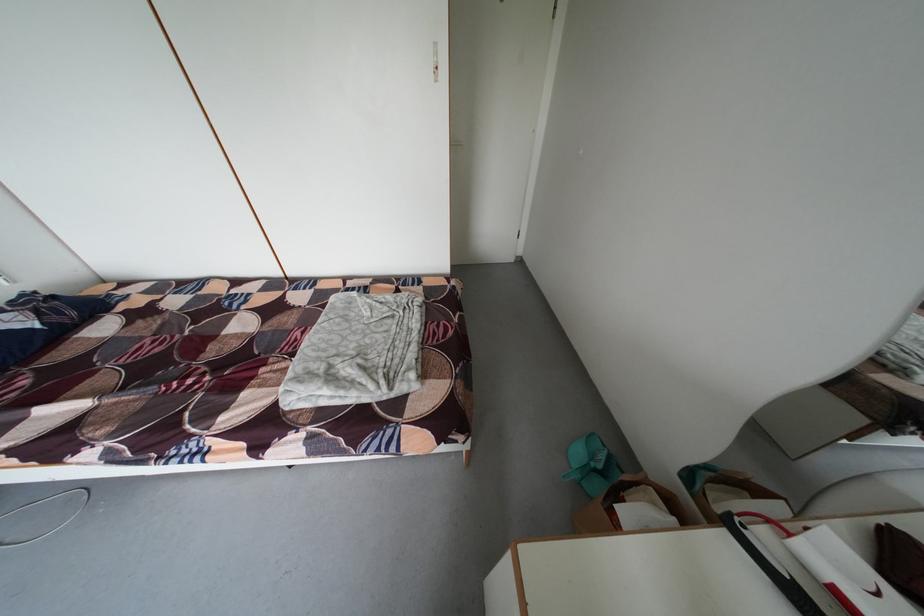
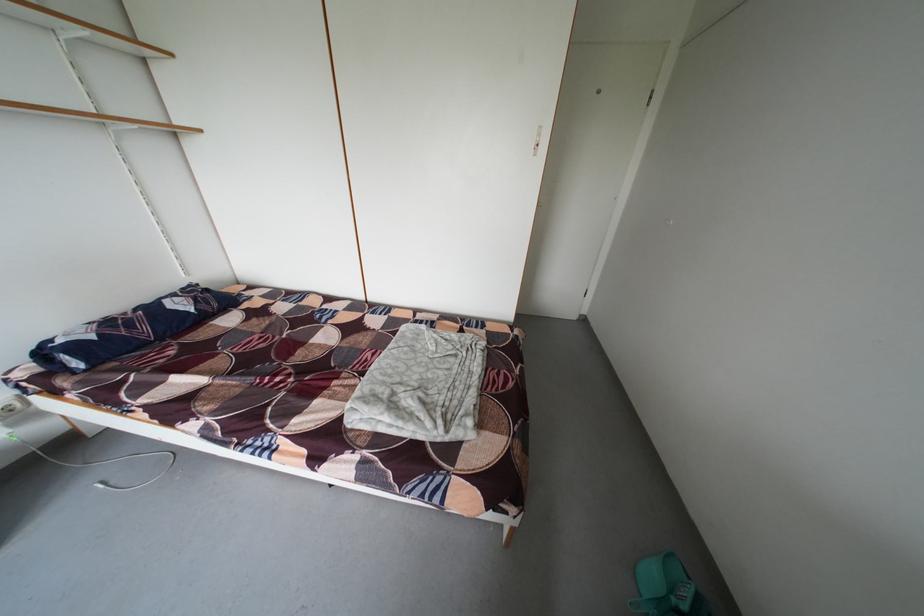
Question: How did the camera likely rotate?

Choices:
 (A) Left
 (B) Right
 (C) Up
 (D) Down

Answer: (A)